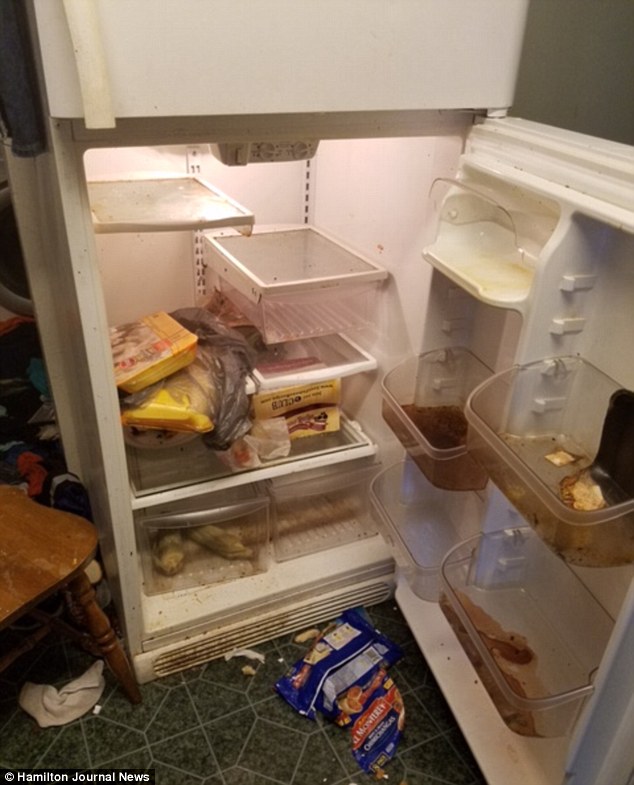
Find the location of a particular element. This screenshot has height=785, width=634. reflection of kitchen light is located at coordinates coord(221,206).